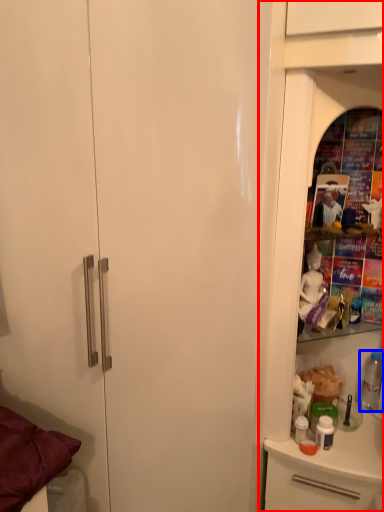
Question: Which of the following is the closest to the observer, dresser (highlighted by a red box) or bottle (highlighted by a blue box)?

Choices:
 (A) dresser
 (B) bottle

Answer: (A)